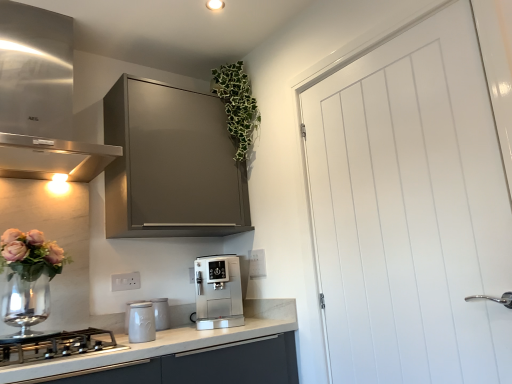
Locate an element on the screen. free space above green leafy plant at upper center (from a real-world perspective) is located at coordinates (226, 52).